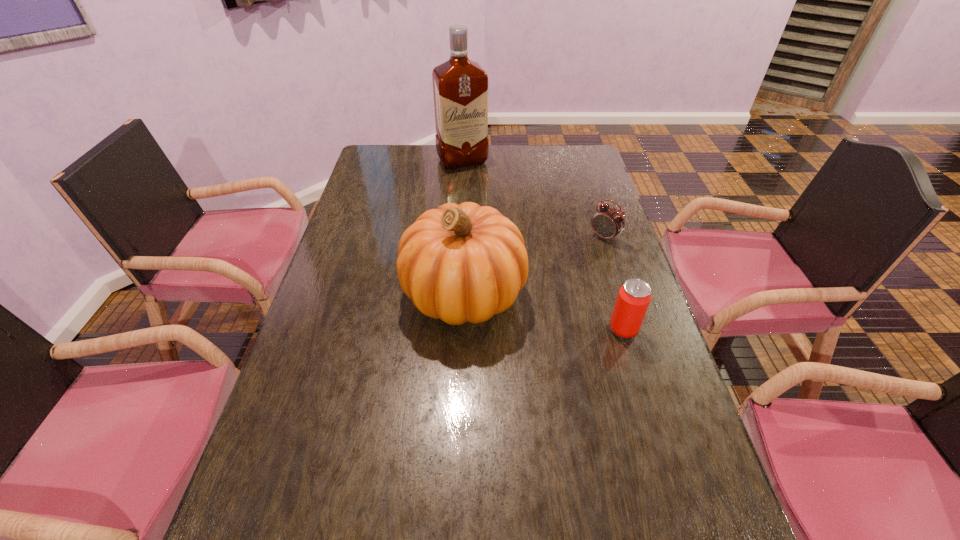
Find the location of a particular element. free space on the desktop that is between the second tallest object and the beer can and is positioned on the face of the alarm clock is located at coordinates (521, 306).

The height and width of the screenshot is (540, 960). I want to click on vacant space on the desktop that is between the pumpkin and the beer can and is positioned on the front label of the farthest object, so click(548, 312).